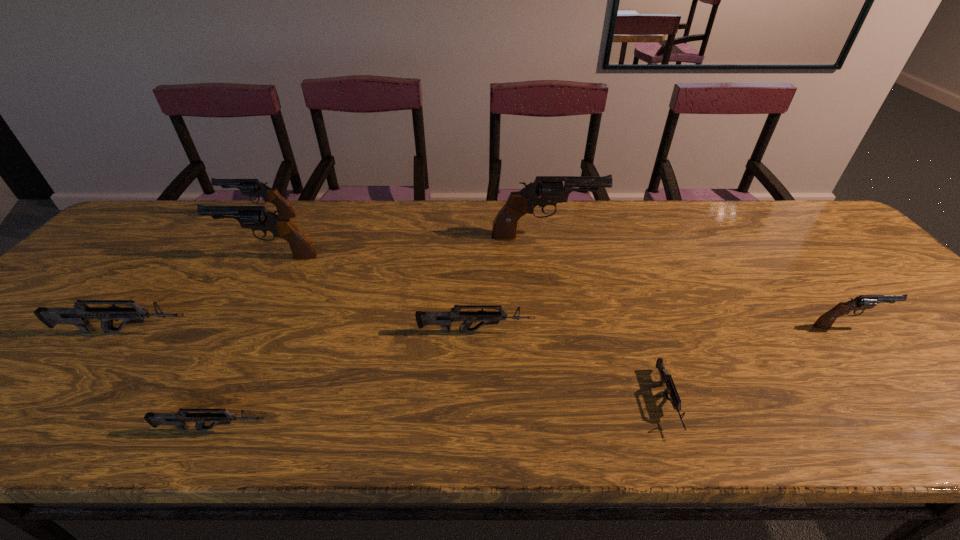
At what (x,y) coordinates should I click in order to perform the action: click on free region located 0.200m along the barrel of the sixth shortest object. Please return your answer as a coordinate pair (x, y). Looking at the image, I should click on (163, 217).

What are the coordinates of `free space located 0.200m along the barrel of the sixth shortest object` in the screenshot? It's located at (163, 217).

This screenshot has height=540, width=960. What are the coordinates of `vacant space located along the barrel of the rightmost black gun` in the screenshot? It's located at (937, 326).

This screenshot has height=540, width=960. I want to click on vacant space located aimed along the barrel of the leftmost grey gun, so pyautogui.click(x=275, y=332).

Identify the location of free space located aimed along the barrel of the third shortest gun. This screenshot has height=540, width=960. (662, 331).

Locate an element on the screen. vacant space positioned 0.140m aimed along the barrel of the seventh tallest gun is located at coordinates (343, 429).

The height and width of the screenshot is (540, 960). Identify the location of object positioned at the left edge. click(x=81, y=314).

I want to click on object that is positioned at the right edge, so click(x=862, y=302).

Locate an element on the screen. The image size is (960, 540). vacant space at the far edge is located at coordinates (638, 207).

Identify the location of free spot at the right edge of the desktop. The height and width of the screenshot is (540, 960). (853, 271).